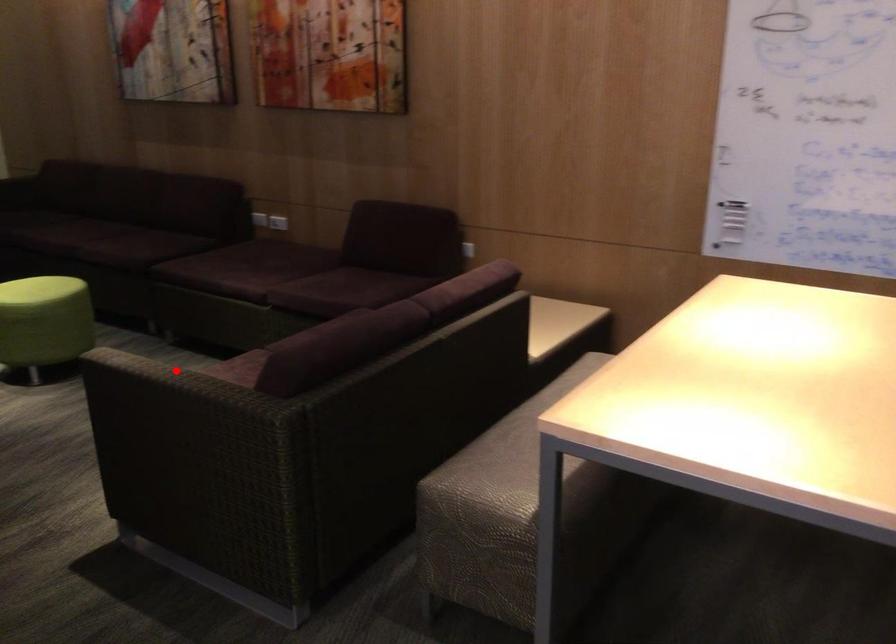
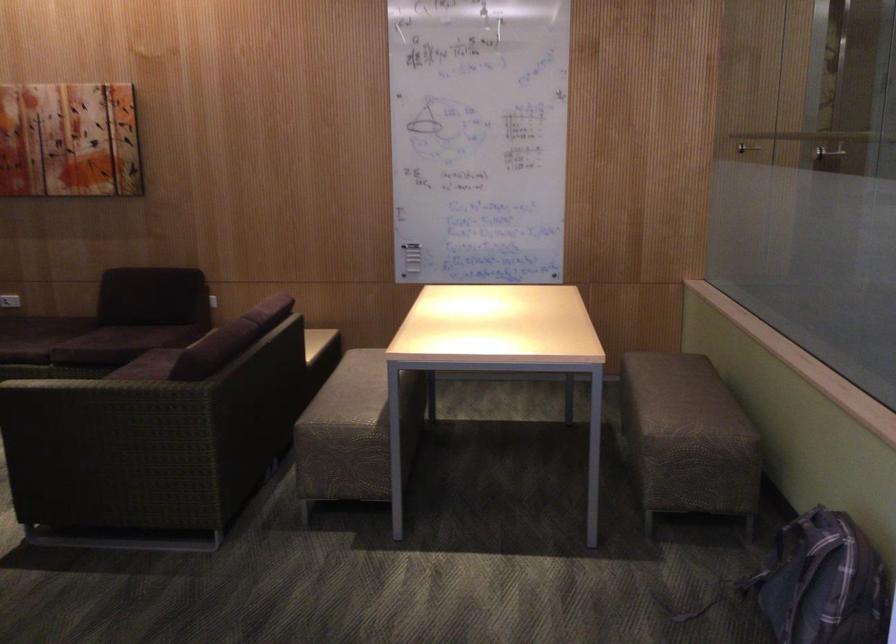
Question: I am providing you with two images of the same scene from different viewpoints. In image1, a red point is highlighted. Considering the same 3D point in image2, which of the following is correct?

Choices:
 (A) It is closer
 (B) It is farther

Answer: (B)